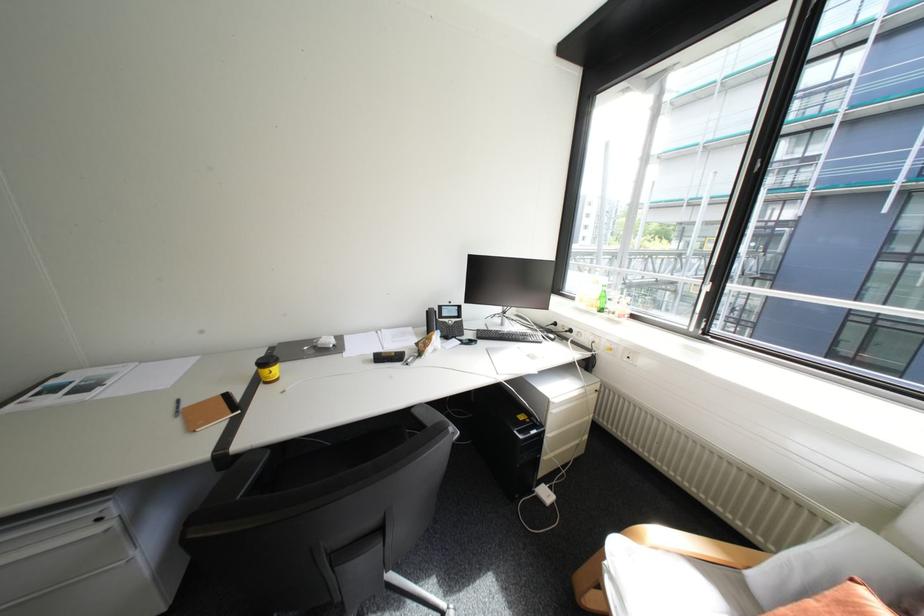
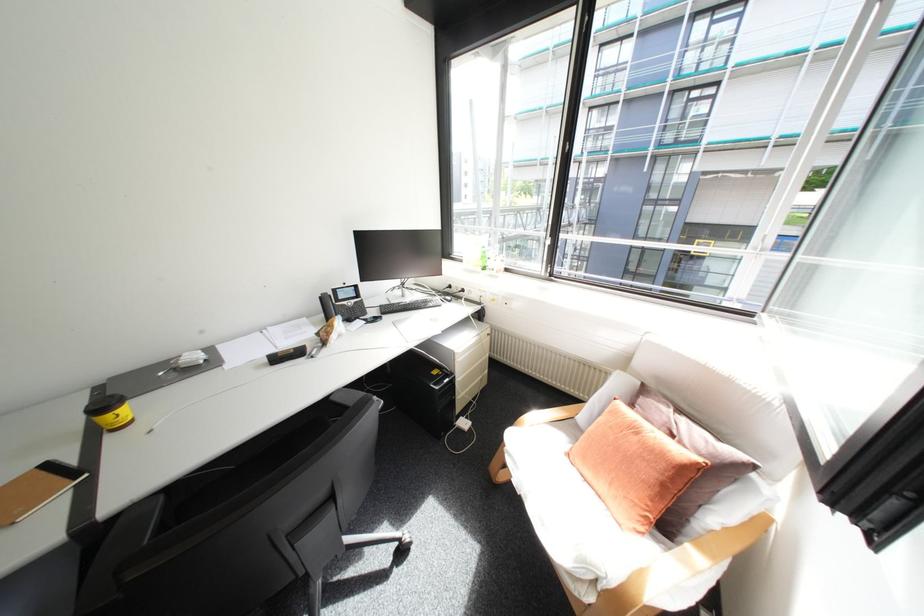
Question: Based on the continuous images, in which direction is the camera rotating? Reply with the corresponding letter.

Choices:
 (A) Left
 (B) Right
 (C) Up
 (D) Down

Answer: (B)